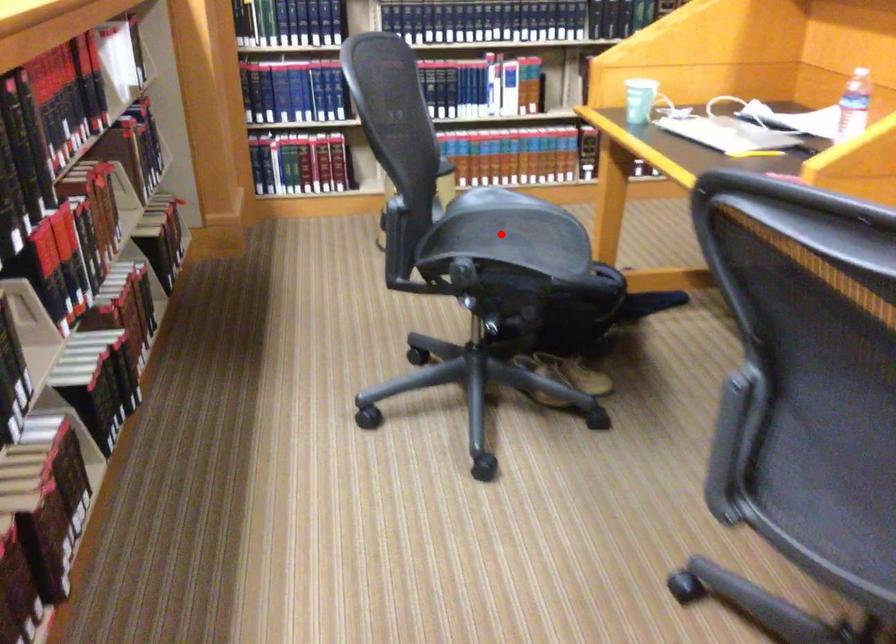
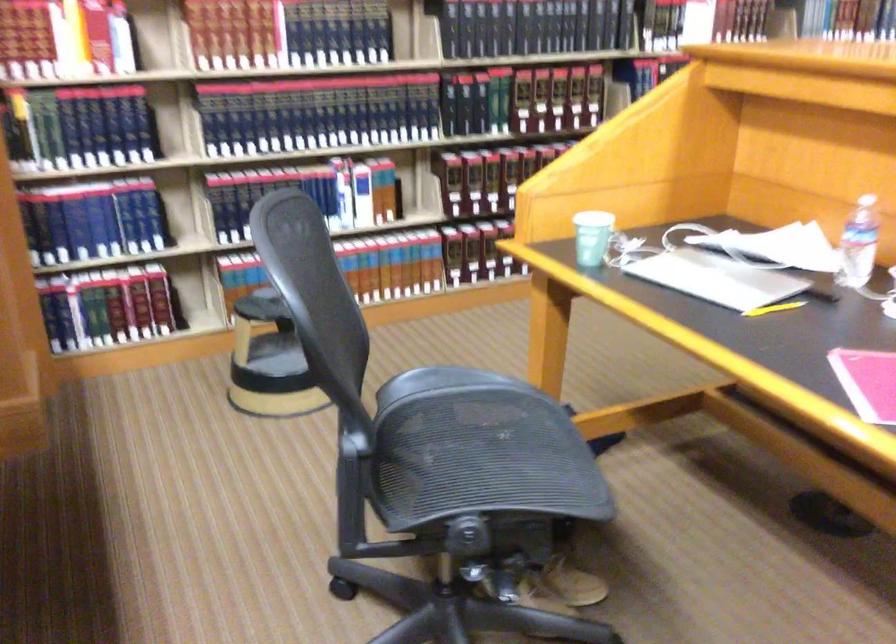
Question: I am providing you with two images of the same scene from different viewpoints. In image1, a red point is highlighted. Considering the same 3D point in image2, which of the following is correct?

Choices:
 (A) It is closer
 (B) It is farther

Answer: (A)